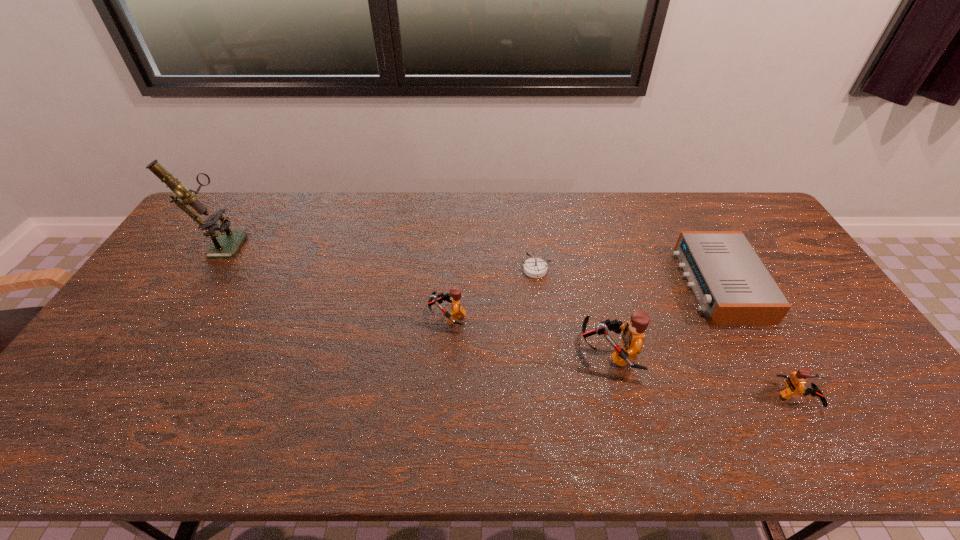
You are a GUI agent. You are given a task and a screenshot of the screen. Output one action in this format:
    pyautogui.click(x=<x>, y=<y>)
    Task: Click on the vacant space that is in between the leftmost Lego and the radio receiver
    
    Given the screenshot: What is the action you would take?
    pyautogui.click(x=583, y=300)

At what (x,y) coordinates should I click in order to perform the action: click on object that is the second closest to the fifth object from right to left. Please return your answer as a coordinate pair (x, y). The width and height of the screenshot is (960, 540). Looking at the image, I should click on (633, 336).

The width and height of the screenshot is (960, 540). Find the location of `object that is the fifth closest to the tallest object`. object that is the fifth closest to the tallest object is located at coordinates (795, 382).

Locate an element on the screen. the second closest Lego to the second tallest Lego is located at coordinates (795, 382).

Point out which Lego is positioned as the second nearest to the second shortest Lego. Please provide its 2D coordinates. Your answer should be formatted as a tuple, i.e. [(x, y)], where the tuple contains the x and y coordinates of a point satisfying the conditions above.

[(795, 382)]

Find the location of a particular element. vacant region that satisfies the following two spatial constraints: 1. at the eyepiece of the microscope; 2. on the back side of the shortest object is located at coordinates (203, 269).

Where is `vacant space that satisfies the following two spatial constraints: 1. on the front side of the shortest object; 2. holding a crossbow in the hands of the second object from left to right`? The image size is (960, 540). vacant space that satisfies the following two spatial constraints: 1. on the front side of the shortest object; 2. holding a crossbow in the hands of the second object from left to right is located at coordinates (541, 316).